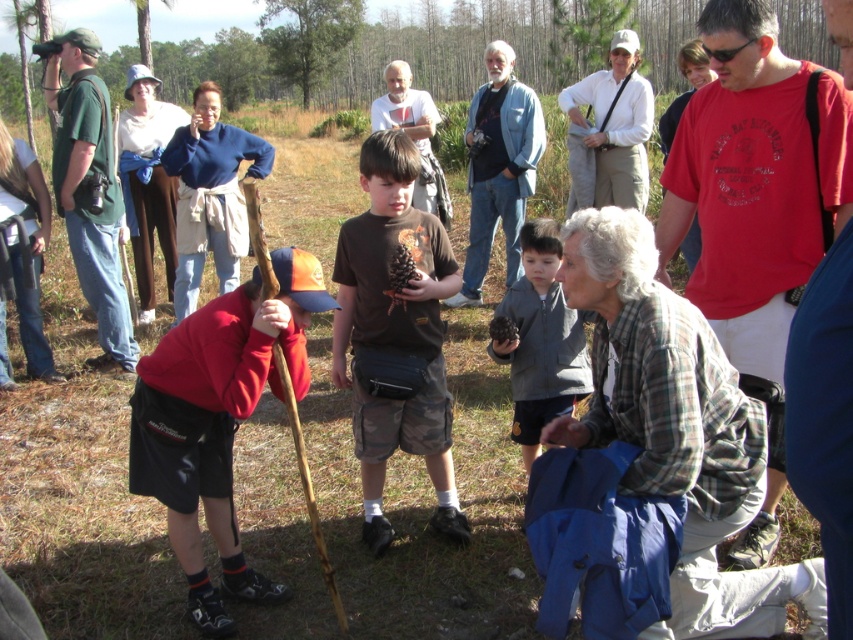
Question: Does green leafy tree at upper center appear over white t-shirt at center?

Choices:
 (A) yes
 (B) no

Answer: (A)

Question: Among these points, which one is nearest to the camera?

Choices:
 (A) (439, 189)
 (B) (80, 160)
 (C) (498, 125)
 (D) (525, 349)

Answer: (D)

Question: Observing the image, what is the correct spatial positioning of brown cotton shirt at center in reference to denim jacket at upper center?

Choices:
 (A) above
 (B) below

Answer: (B)

Question: Among these objects, which one is farthest from the camera?

Choices:
 (A) gray fleece jacket at center
 (B) denim jacket at upper center
 (C) white cotton shirt at center
 (D) matte red t-shirt at center

Answer: (C)

Question: Estimate the real-world distances between objects in this image. Which object is farther from the green cotton shirt at left?

Choices:
 (A) white t-shirt at center
 (B) green leafy tree at upper center
 (C) plaid flannel shirt at lower right
 (D) brown cotton shirt at center

Answer: (B)

Question: Is denim jacket at upper center positioned at the back of white cotton shirt at center?

Choices:
 (A) no
 (B) yes

Answer: (A)